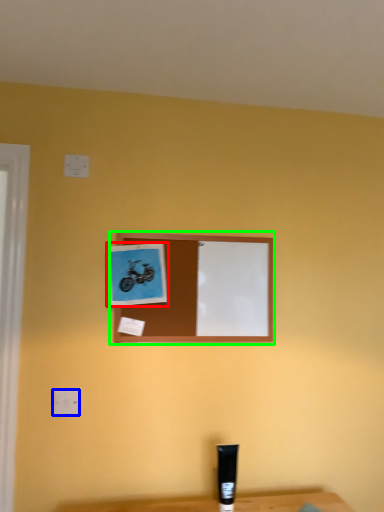
Question: Estimate the real-world distances between objects in this image. Which object is closer to picture frame (highlighted by a red box), electric outlet (highlighted by a blue box) or picture frame (highlighted by a green box)?

Choices:
 (A) electric outlet
 (B) picture frame

Answer: (B)